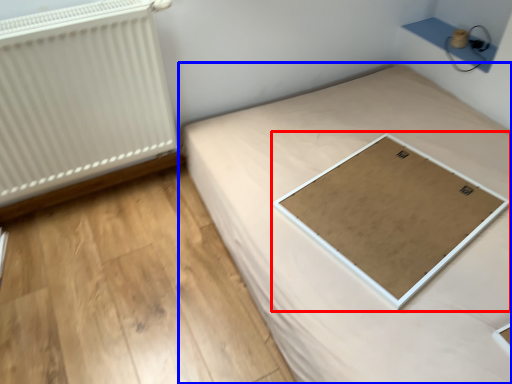
Question: Which point is closer to the camera, table (highlighted by a red box) or bed (highlighted by a blue box)?

Choices:
 (A) table
 (B) bed

Answer: (B)